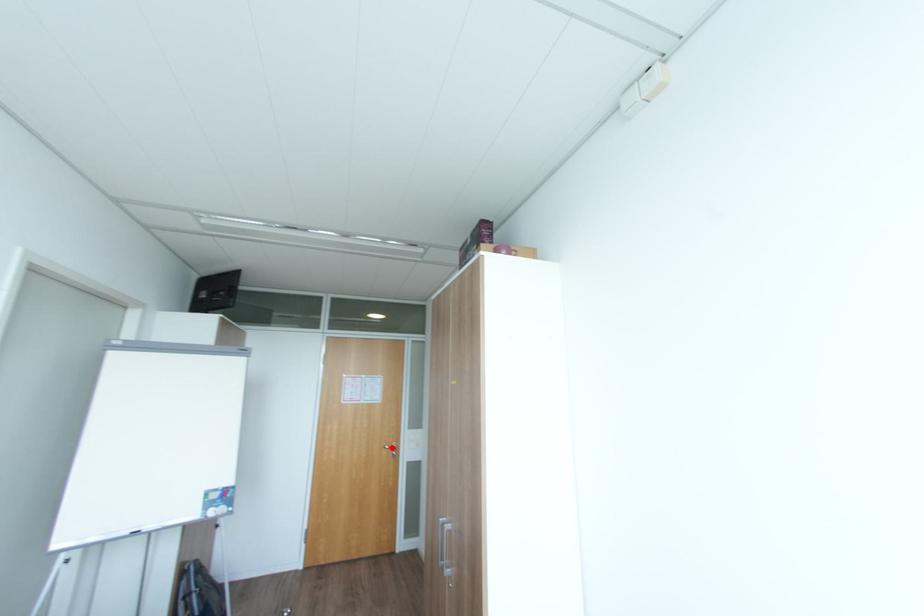
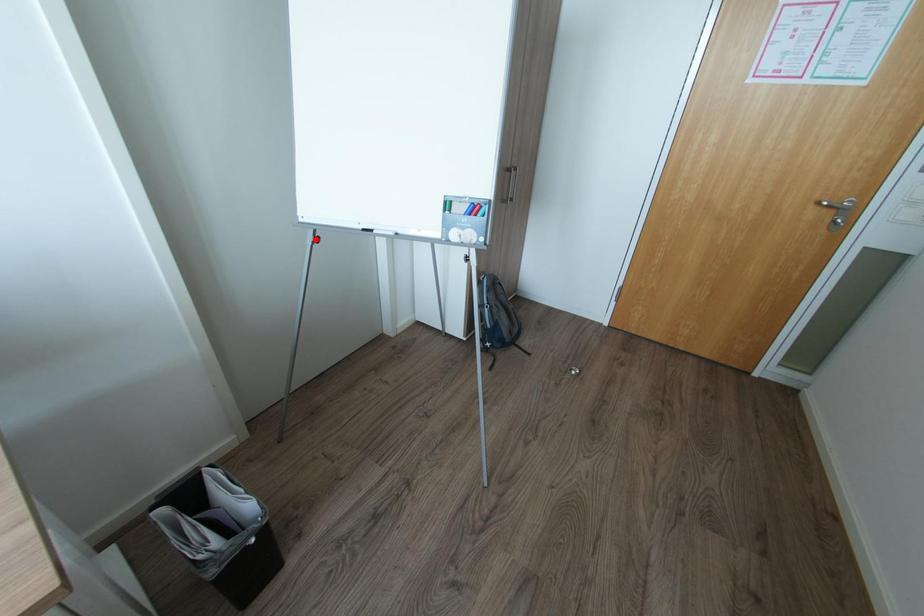
I am providing you with two images of the same scene from different viewpoints. A red point is marked on the first image and another point is marked on the second image. Do the highlighted points in image1 and image2 indicate the same real-world spot?

No